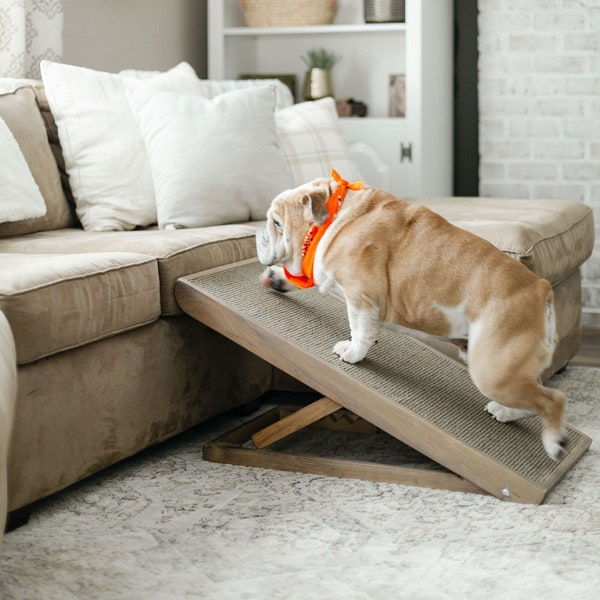
At what (x,y) coordinates should I click in order to perform the action: click on sofa. Please return your answer as a coordinate pair (x, y). Looking at the image, I should click on (152, 371).